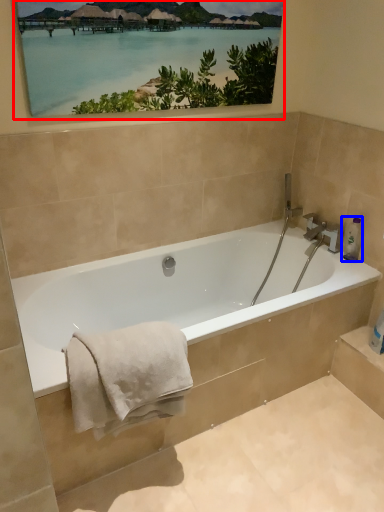
Question: Which object is closer to the camera taking this photo, picture frame (highlighted by a red box) or toiletry (highlighted by a blue box)?

Choices:
 (A) picture frame
 (B) toiletry

Answer: (A)